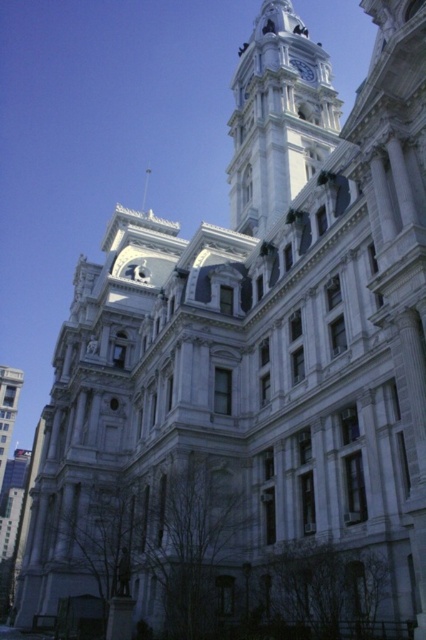
Is white stone clock tower at upper center to the left of blue glossy clock at upper center from the viewer's perspective?

Correct, you'll find white stone clock tower at upper center to the left of blue glossy clock at upper center.

Is white stone clock tower at upper center closer to camera compared to blue glossy clock at upper center?

Yes, white stone clock tower at upper center is in front of blue glossy clock at upper center.

Describe the element at coordinates (278, 118) in the screenshot. The image size is (426, 640). I see `white stone clock tower at upper center` at that location.

This screenshot has height=640, width=426. In order to click on white stone clock tower at upper center in this screenshot , I will do click(278, 118).